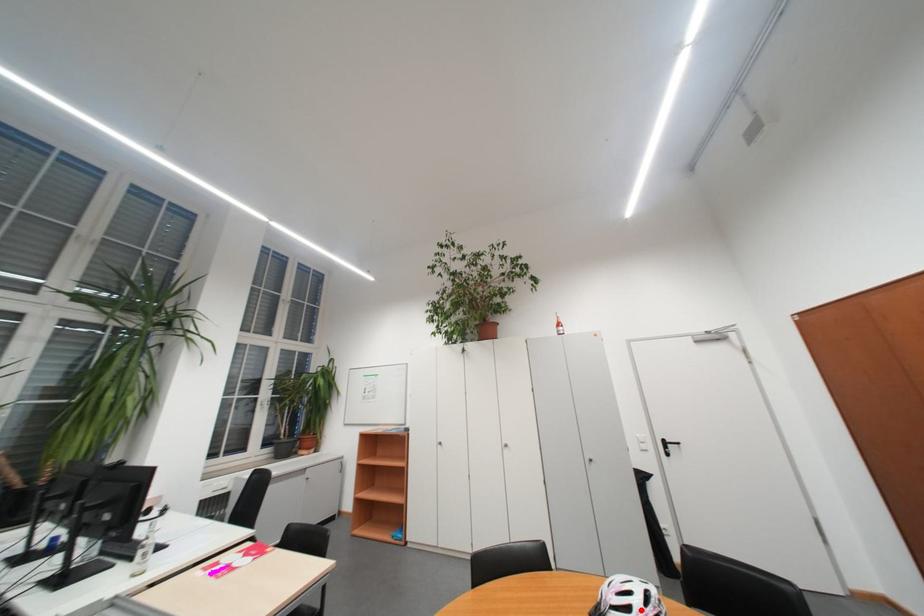
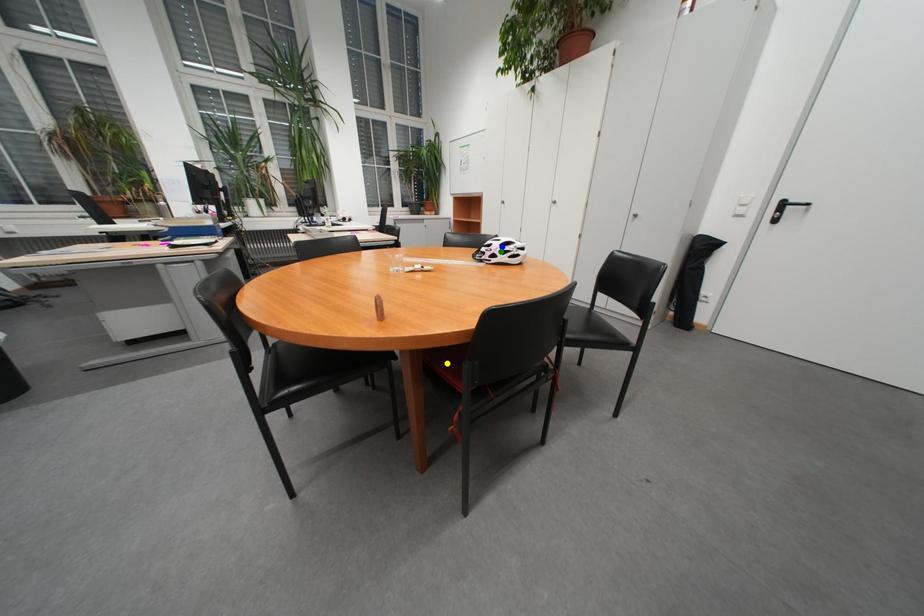
Question: I am providing you with two images of the same scene from different viewpoints. A red point is marked on the first image. You are given multiple points on the second image. Which point in image 2 represents the same 3d spot as the red point in image 1?

Choices:
 (A) blue point
 (B) green point
 (C) yellow point

Answer: (A)